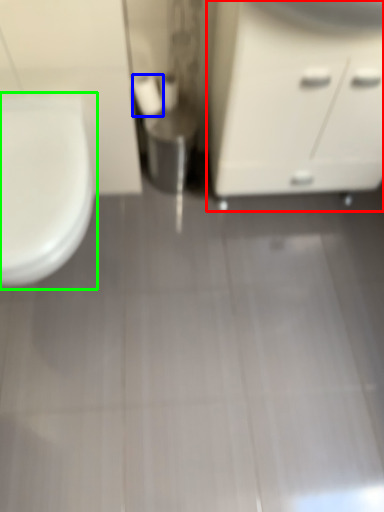
Question: Which is farther away from bathroom cabinet (highlighted by a red box)? toilet paper (highlighted by a blue box) or toilet (highlighted by a green box)?

Choices:
 (A) toilet paper
 (B) toilet

Answer: (B)